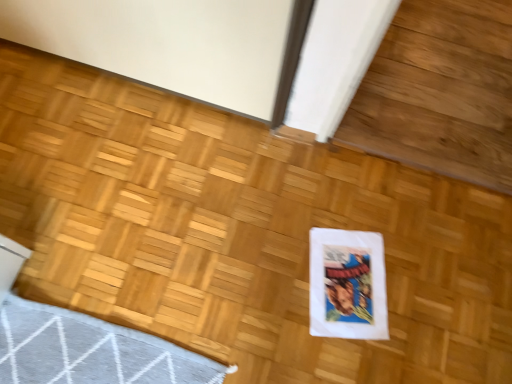
Where is `free point in front of white paper comic book at lower right`? free point in front of white paper comic book at lower right is located at coordinates (329, 356).